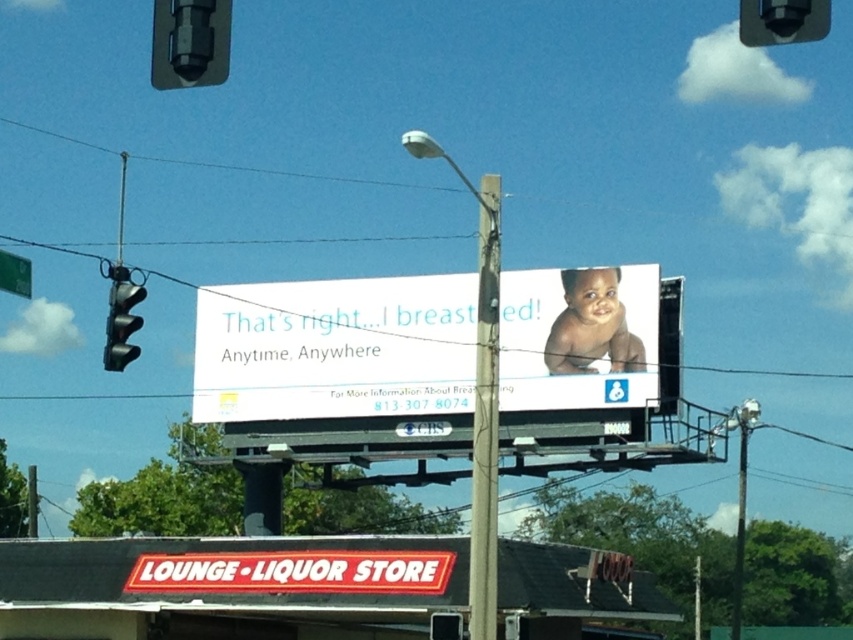
Question: Which of the following is the farthest from the observer?

Choices:
 (A) (732, 625)
 (B) (215, 20)
 (C) (577, 304)

Answer: (A)

Question: Which point is closer to the camera taking this photo?

Choices:
 (A) (200, 13)
 (B) (115, 349)
 (C) (735, 564)
 (D) (27, 289)

Answer: (A)

Question: Which object is farther from the camera taking this photo?

Choices:
 (A) smooth skin baby at center
 (B) metallic gray pole at center
 (C) black plastic traffic light at left
 (D) green plastic street sign at upper left

Answer: (B)

Question: Does matte white billboard at center have a smaller size compared to black plastic traffic light at left?

Choices:
 (A) yes
 (B) no

Answer: (A)

Question: Is black plastic traffic light at left to the right of green plastic street sign at upper left from the viewer's perspective?

Choices:
 (A) yes
 (B) no

Answer: (B)

Question: Can you confirm if smooth skin baby at center is positioned below green plastic street sign at upper left?

Choices:
 (A) yes
 (B) no

Answer: (A)